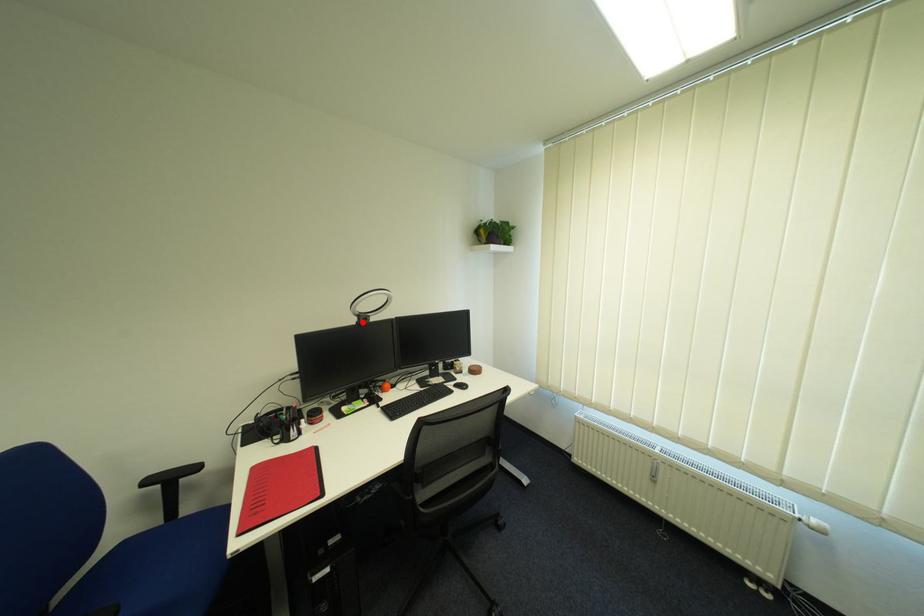
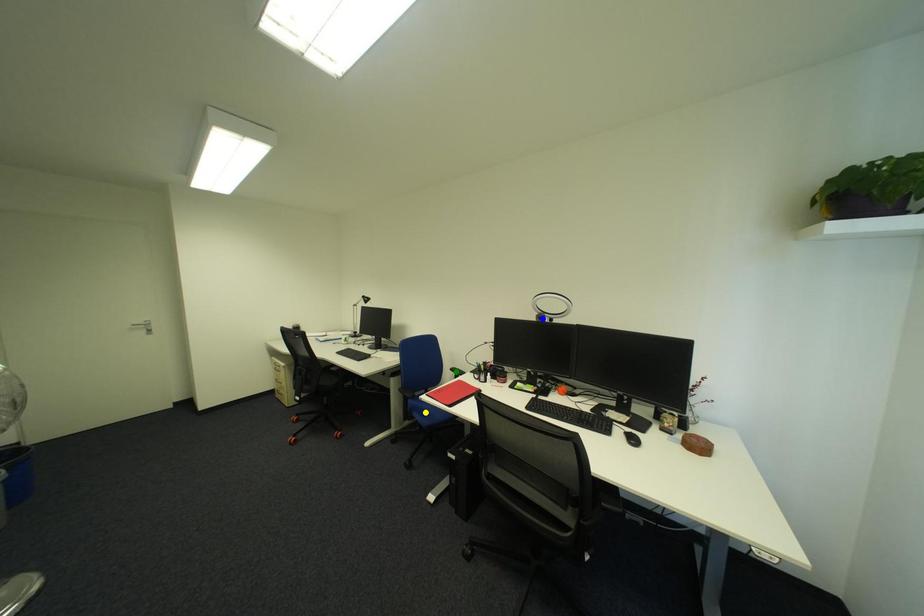
Question: I am providing you with two images of the same scene from different viewpoints. A red point is marked on the first image. You are given multiple points on the second image. Which point in image 2 represents the same 3d spot as the red point in image 1?

Choices:
 (A) green point
 (B) blue point
 (C) yellow point

Answer: (B)